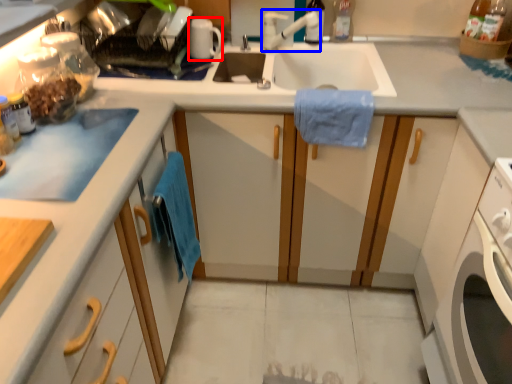
Question: Which object appears farthest to the camera in this image, appliance (highlighted by a red box) or faucet (highlighted by a blue box)?

Choices:
 (A) appliance
 (B) faucet

Answer: (A)